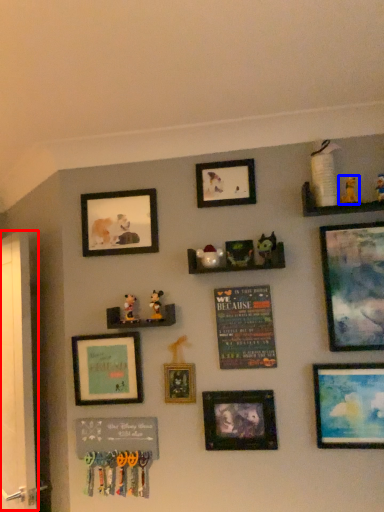
Question: Among these objects, which one is farthest to the camera, screen door (highlighted by a red box) or toy (highlighted by a blue box)?

Choices:
 (A) screen door
 (B) toy

Answer: (A)